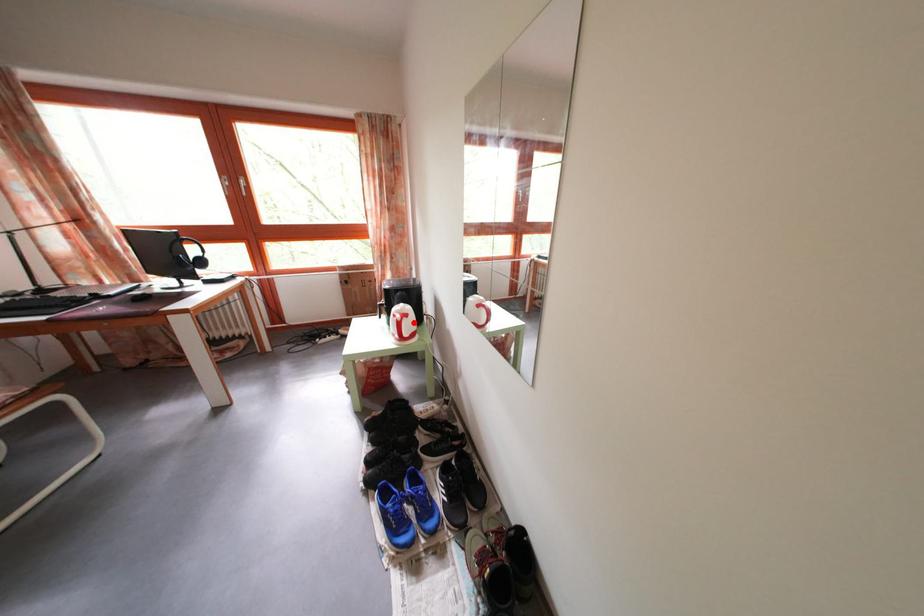
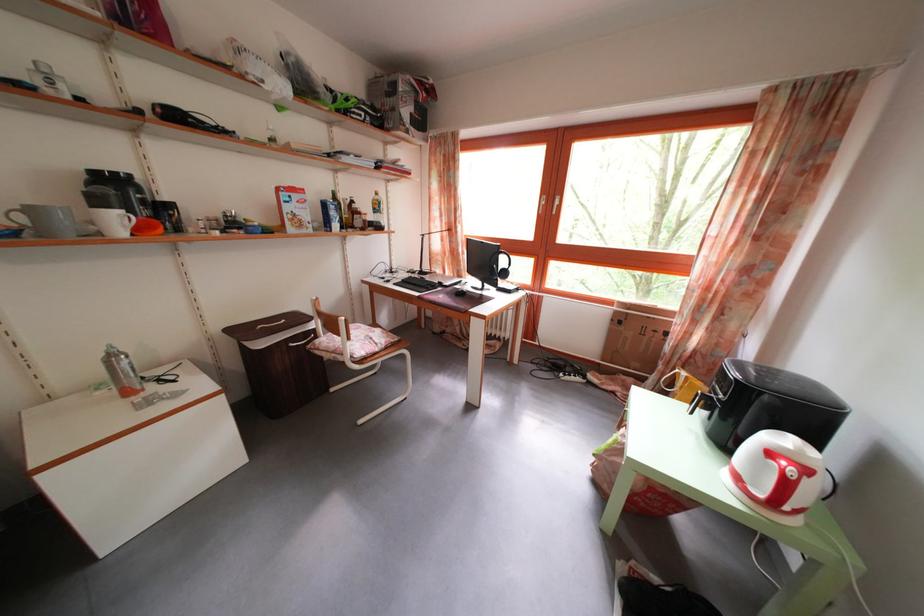
Question: I am providing you with two images of the same scene from different viewpoints. Given a red point in image1, look at the same physical point in image2. Is it:

Choices:
 (A) Closer to the viewpoint
 (B) Farther from the viewpoint

Answer: (B)